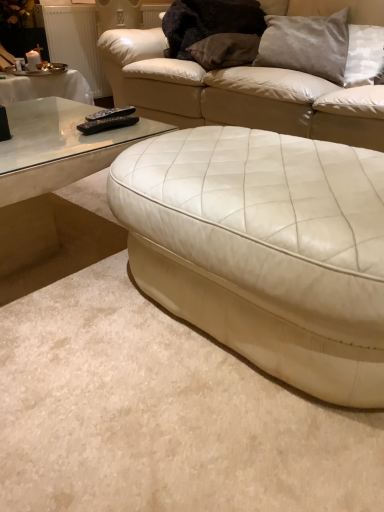
Question: Considering the relative sizes of satin gray pillow at upper right, which is counted as the 1th pillow, starting from the right, and black plastic remote at left, positioned as the 2th remote in front-to-back order, in the image provided, is satin gray pillow at upper right, which is counted as the 1th pillow, starting from the right, bigger than black plastic remote at left, positioned as the 2th remote in front-to-back order,?

Choices:
 (A) yes
 (B) no

Answer: (A)

Question: Is satin gray pillow at upper right, positioned as the 2th pillow in left-to-right order, positioned before black plastic remote at left, which appears as the 1th remote when viewed from the back?

Choices:
 (A) yes
 (B) no

Answer: (B)

Question: Can you confirm if satin gray pillow at upper right, positioned as the 2th pillow in left-to-right order, is smaller than black plastic remote at left, which appears as the 1th remote when viewed from the back?

Choices:
 (A) no
 (B) yes

Answer: (A)

Question: Is satin gray pillow at upper right, which is counted as the 1th pillow, starting from the right, oriented towards black plastic remote at left, positioned as the 2th remote in front-to-back order?

Choices:
 (A) yes
 (B) no

Answer: (B)

Question: Is satin gray pillow at upper right, which is counted as the 1th pillow, starting from the right, located outside black plastic remote at left, positioned as the 2th remote in front-to-back order?

Choices:
 (A) no
 (B) yes

Answer: (B)

Question: Considering the positions of black plastic remote at left, which appears as the 1th remote when viewed from the back, and satin gray pillow at upper right, positioned as the 2th pillow in left-to-right order, in the image, is black plastic remote at left, which appears as the 1th remote when viewed from the back, taller or shorter than satin gray pillow at upper right, positioned as the 2th pillow in left-to-right order,?

Choices:
 (A) tall
 (B) short

Answer: (B)

Question: From a real-world perspective, relative to satin gray pillow at upper right, which is counted as the 1th pillow, starting from the right, is black plastic remote at left, which appears as the 1th remote when viewed from the back, vertically above or below?

Choices:
 (A) above
 (B) below

Answer: (B)

Question: Considering the positions of black plastic remote at left, positioned as the 2th remote in front-to-back order, and satin gray pillow at upper right, positioned as the 2th pillow in left-to-right order, in the image, is black plastic remote at left, positioned as the 2th remote in front-to-back order, bigger or smaller than satin gray pillow at upper right, positioned as the 2th pillow in left-to-right order,?

Choices:
 (A) small
 (B) big

Answer: (A)

Question: Considering their positions, is black plastic remote at left, positioned as the 2th remote in front-to-back order, located in front of or behind satin gray pillow at upper right, which is counted as the 1th pillow, starting from the right?

Choices:
 (A) behind
 (B) front

Answer: (B)

Question: In terms of height, does white leather studio couch at center, which is the second studio couch in front-to-back order, look taller or shorter compared to black plastic remote at left, the 1th remote positioned from the front?

Choices:
 (A) tall
 (B) short

Answer: (A)

Question: Considering the positions of point (279, 7) and point (129, 117), is point (279, 7) closer or farther from the camera than point (129, 117)?

Choices:
 (A) closer
 (B) farther

Answer: (B)

Question: Would you say white leather studio couch at center, the 1th studio couch from the back, is to the left or to the right of black plastic remote at left, which is the second remote in back-to-front order, in the picture?

Choices:
 (A) left
 (B) right

Answer: (B)

Question: From a real-world perspective, is white leather studio couch at center, the 1th studio couch from the back, positioned above or below black plastic remote at left, which is the second remote in back-to-front order?

Choices:
 (A) below
 (B) above

Answer: (A)

Question: From the image's perspective, is black plastic remote at left, which is the second remote in back-to-front order, above or below transparent glass coffee table at left?

Choices:
 (A) above
 (B) below

Answer: (A)

Question: Choose the correct answer: Is black plastic remote at left, which is the second remote in back-to-front order, inside transparent glass coffee table at left or outside it?

Choices:
 (A) outside
 (B) inside

Answer: (A)